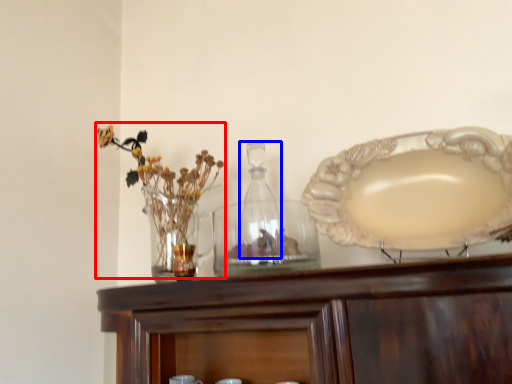
Question: Which of the following is the closest to the observer, floral arrangement (highlighted by a red box) or bottle (highlighted by a blue box)?

Choices:
 (A) floral arrangement
 (B) bottle

Answer: (A)